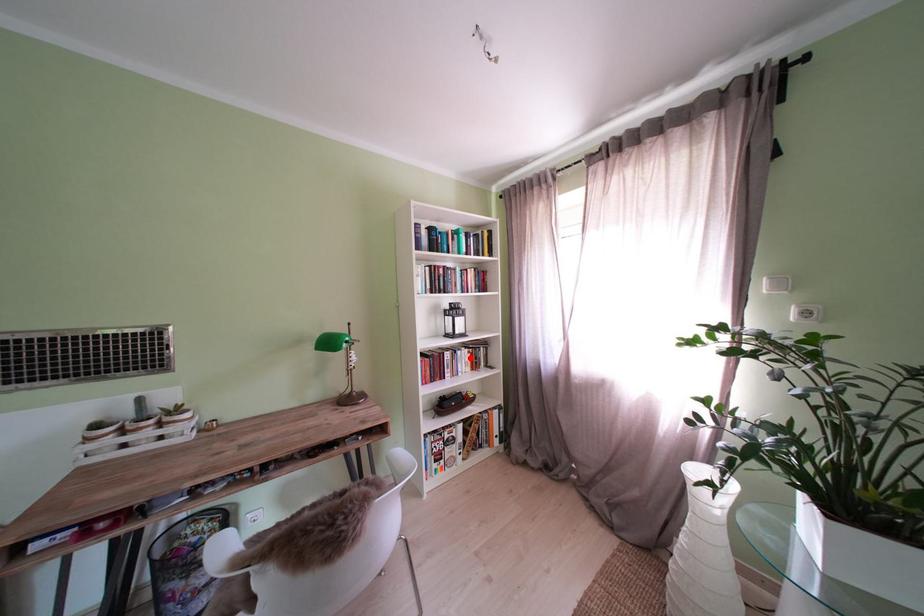
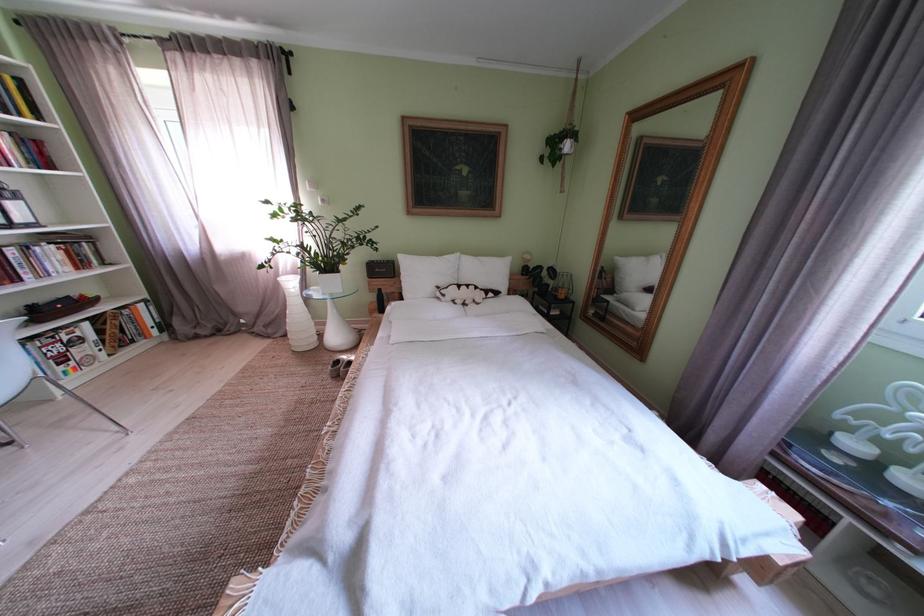
In the second image, find the point that corresponds to the highlighted location in the first image.

(49, 254)